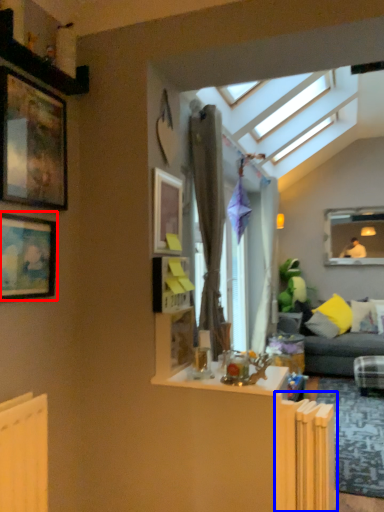
Question: Among these objects, which one is farthest to the camera, picture frame (highlighted by a red box) or radiator (highlighted by a blue box)?

Choices:
 (A) picture frame
 (B) radiator

Answer: (B)